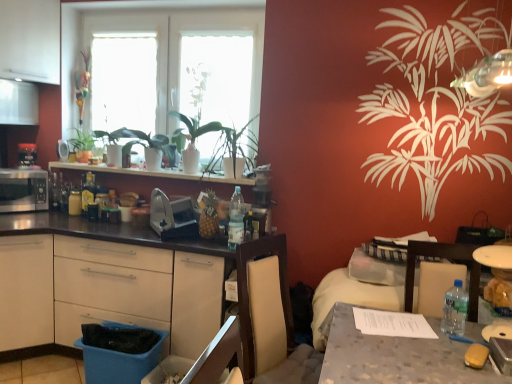
Identify the location of vacant region below blue plastic drawer at lower left (from a real-world perspective). This screenshot has height=384, width=512. (115, 344).